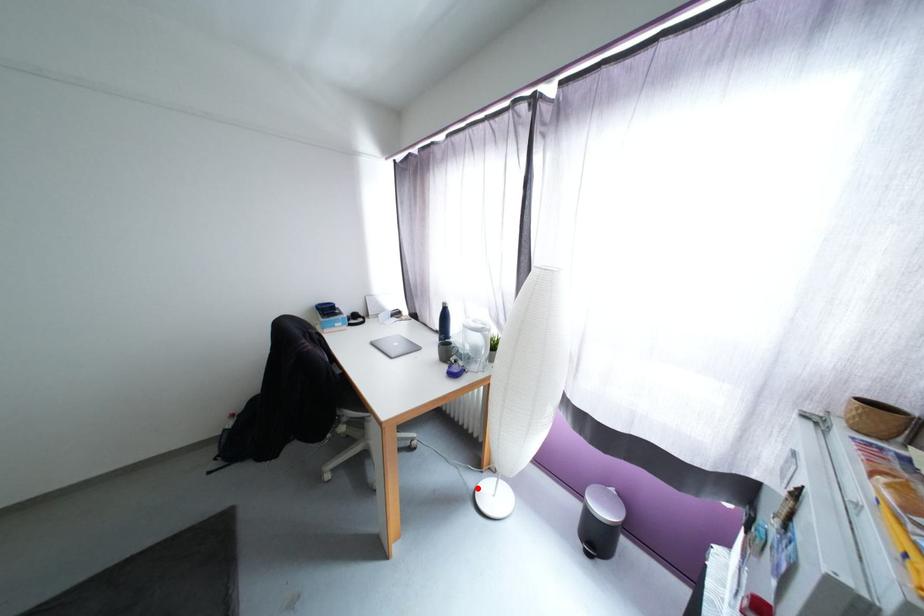
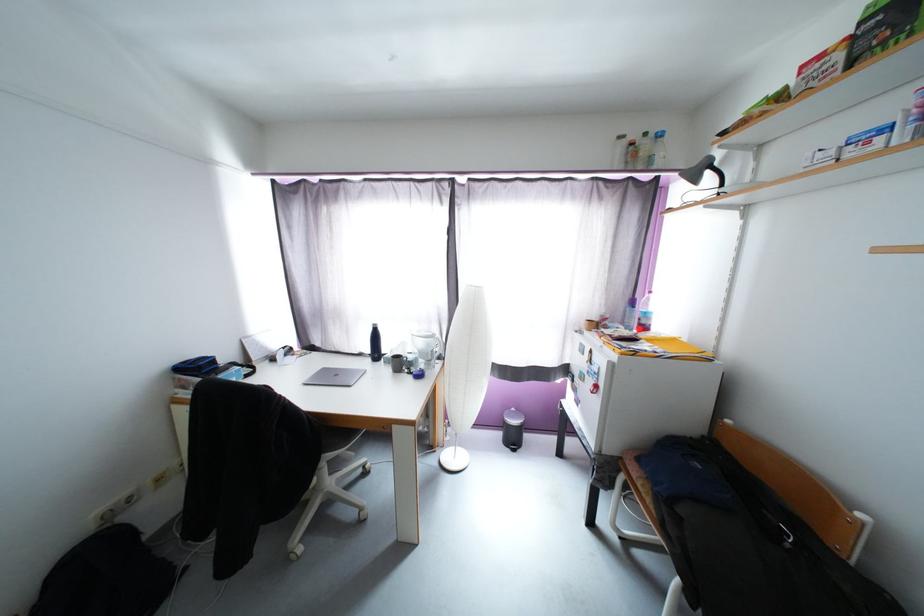
In the second image, find the point that corresponds to the highlighted location in the first image.

(442, 464)